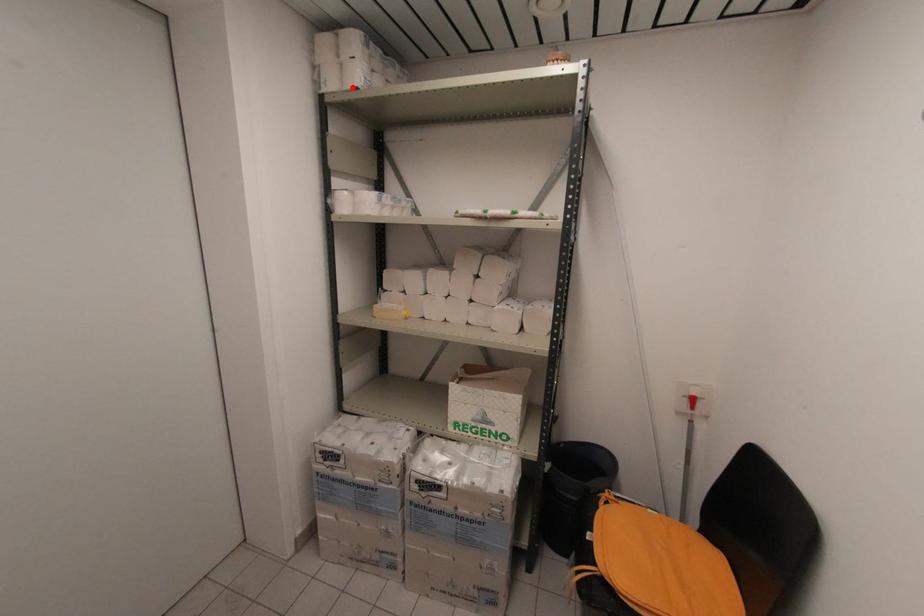
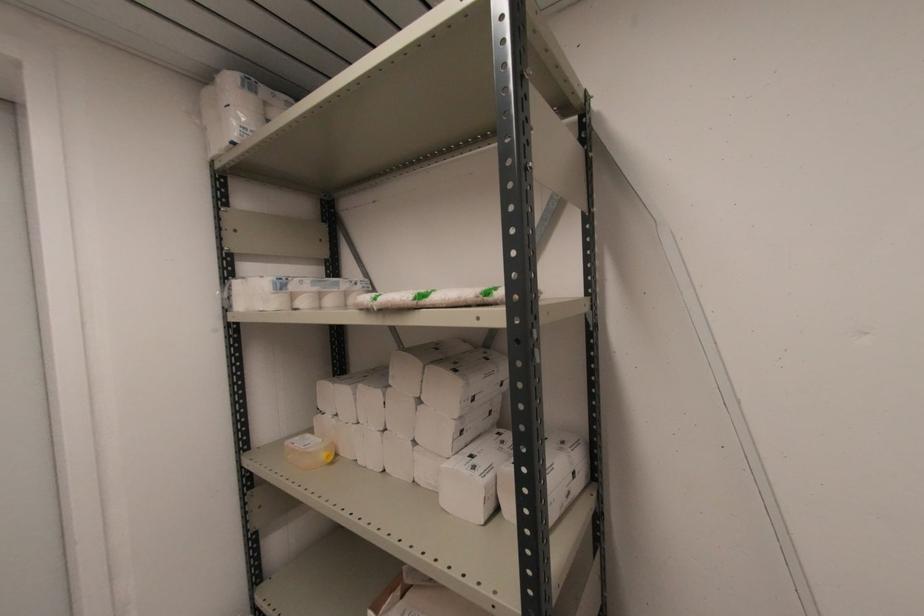
Find the pixel in the second image that matches the highlighted location in the first image.

(227, 144)